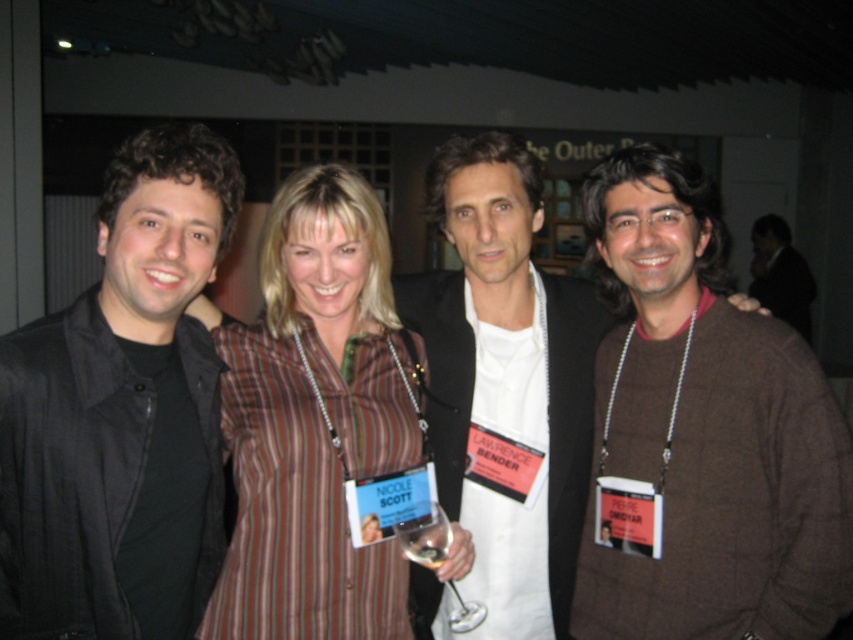
You are at a conference and need to hand a document to the person wearing the striped fabric shirt at center. You are currently standing in front of the black matte jacket at left. Can you directly hand the document without moving around?

The black matte jacket at left is closer to the viewer than striped fabric shirt at center, so you are standing in front of the black matte jacket at left which is closer. Therefore, the striped fabric shirt at center is behind the black matte jacket at left. You cannot directly hand the document without moving around because the striped fabric shirt at center is behind the black matte jacket at left.

You are at a wine tasting event and need to pick up the clear glass wine glass at center without touching the brown textured sweater at center. Is this possible based on their positions?

The brown textured sweater at center is above the clear glass wine glass at center, so you can carefully reach under the sweater to pick up the glass without touching it.